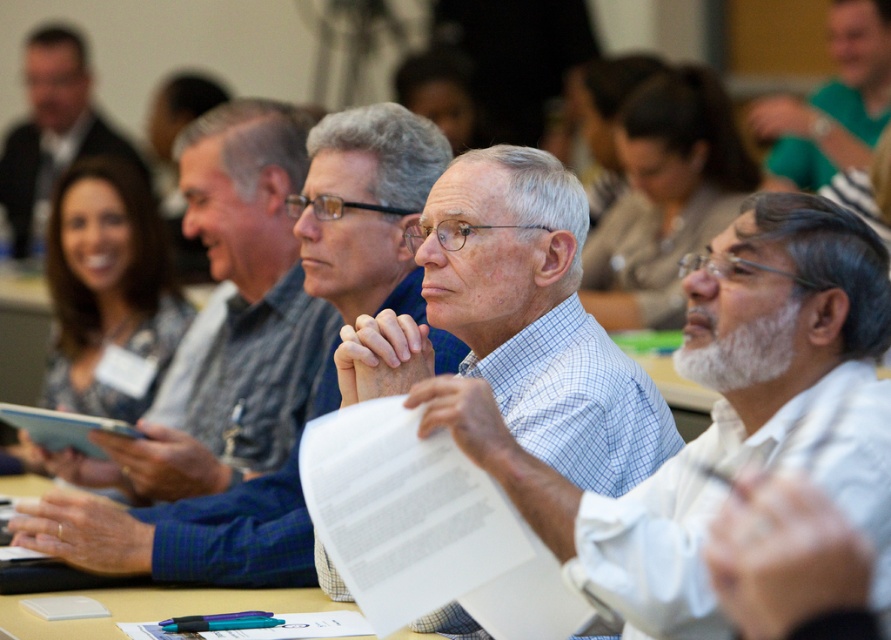
Question: Which is farther from the blue checkered shirt at center?

Choices:
 (A) matte black shirt at upper left
 (B) white checkered shirt at center
 (C) green jersey at upper right
 (D) blue plaid shirt at center

Answer: (A)

Question: Which point is farther from the camera taking this photo?

Choices:
 (A) (778, 124)
 (B) (765, 374)

Answer: (A)

Question: Observing the image, what is the correct spatial positioning of white checkered shirt at center in reference to matte black shirt at upper left?

Choices:
 (A) below
 (B) above

Answer: (A)

Question: Which object appears closest to the camera in this image?

Choices:
 (A) green jersey at upper right
 (B) blue checkered shirt at center
 (C) white checkered shirt at center
 (D) matte black shirt at upper left

Answer: (B)

Question: From the image, what is the correct spatial relationship of blue checkered shirt at center in relation to matte black shirt at upper left?

Choices:
 (A) right
 (B) left

Answer: (A)

Question: Is blue checkered shirt at center wider than white checkered shirt at center?

Choices:
 (A) no
 (B) yes

Answer: (B)